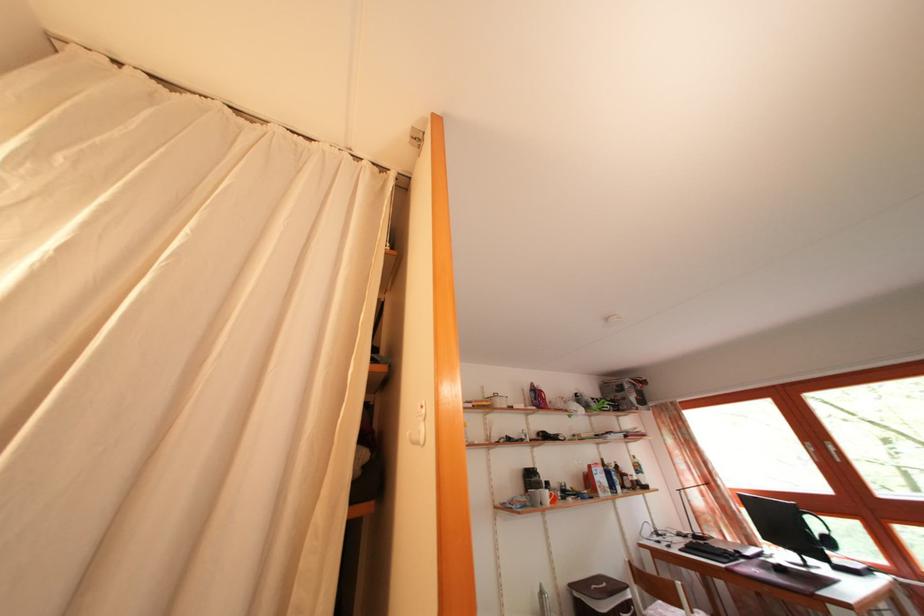
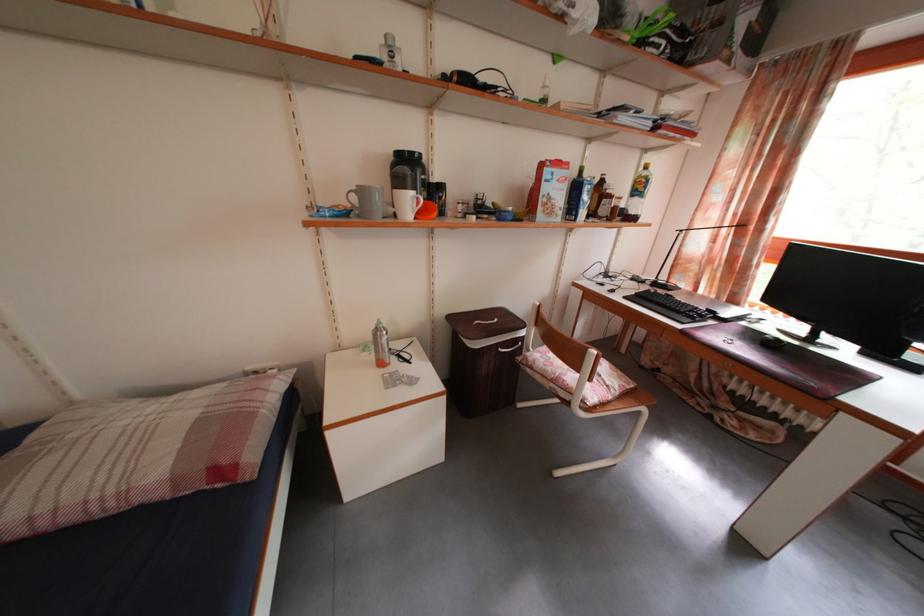
Find the pixel in the second image that matches the point at 704,538 in the first image.

(671, 285)